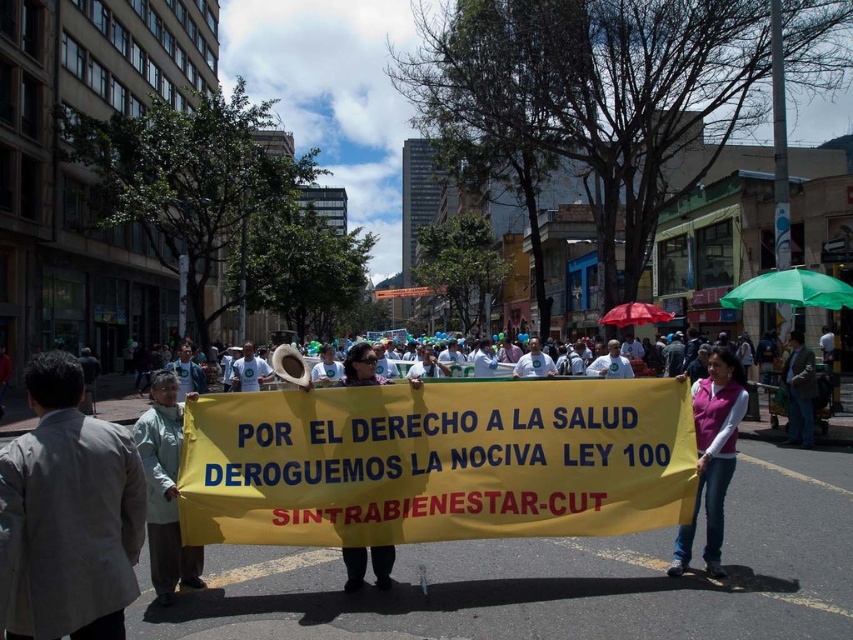
Which is above, yellow paper banner at center or pink fabric shirt at center?

Positioned higher is yellow paper banner at center.

Is point (299, 390) positioned before point (808, 419)?

Yes, point (299, 390) is in front of point (808, 419).

Locate an element on the screen. Image resolution: width=853 pixels, height=640 pixels. yellow paper banner at center is located at coordinates (436, 461).

Identify the location of yellow paper banner at center. (436, 461).

Between point (310, 433) and point (769, 291), which one is positioned in front?

Point (310, 433)

Is point (543, 452) closer to viewer compared to point (778, 280)?

That is True.

This screenshot has height=640, width=853. Identify the location of yellow paper banner at center. (436, 461).

Is light green fabric at center bigger than matte yellow banner at center?

No, light green fabric at center is not bigger than matte yellow banner at center.

You are a GUI agent. You are given a task and a screenshot of the screen. Output one action in this format:
    pyautogui.click(x=<x>, y=<y>)
    Task: Click on the light green fabric at center
    The height and width of the screenshot is (640, 853).
    Given the screenshot: What is the action you would take?
    pyautogui.click(x=164, y=490)